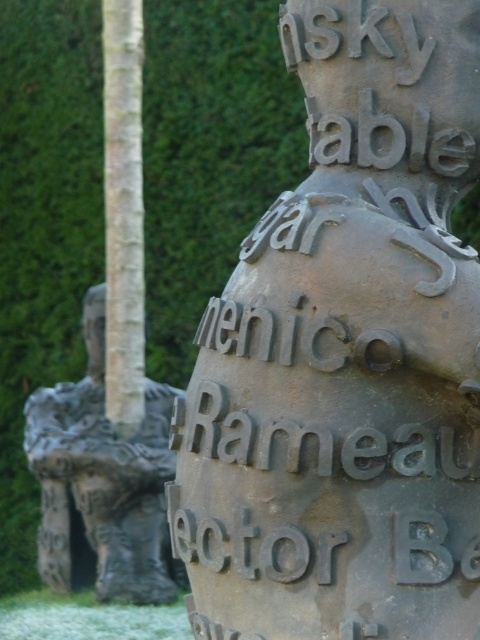
Question: Where is rusty metal sculpture at center located in relation to rough stone elephant at left in the image?

Choices:
 (A) right
 (B) left

Answer: (A)

Question: Does rusty metal sculpture at center have a smaller size compared to rough stone elephant at left?

Choices:
 (A) no
 (B) yes

Answer: (A)

Question: Does rusty metal sculpture at center appear under rough stone elephant at left?

Choices:
 (A) yes
 (B) no

Answer: (B)

Question: Which point is closer to the camera?

Choices:
 (A) rusty metal sculpture at center
 (B) rough stone elephant at left

Answer: (A)

Question: Which of the following is the farthest from the observer?

Choices:
 (A) rough stone elephant at left
 (B) rusty metal sculpture at center

Answer: (A)